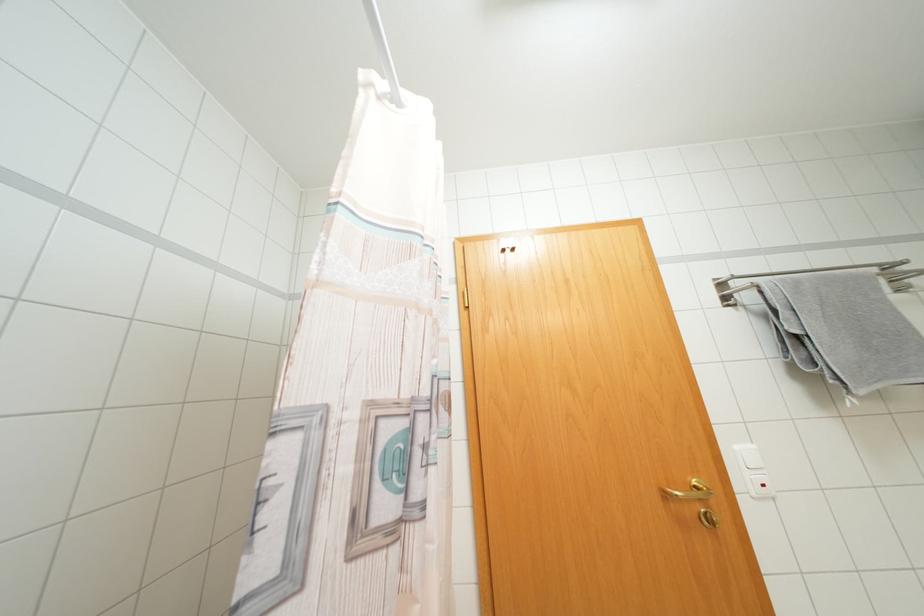
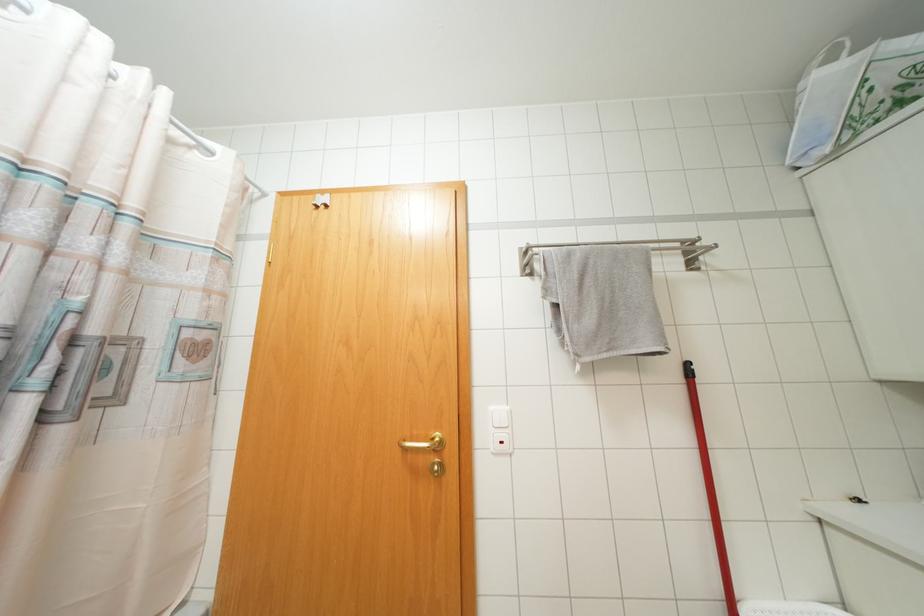
Question: How did the camera likely rotate?

Choices:
 (A) Left
 (B) Right
 (C) Up
 (D) Down

Answer: (D)